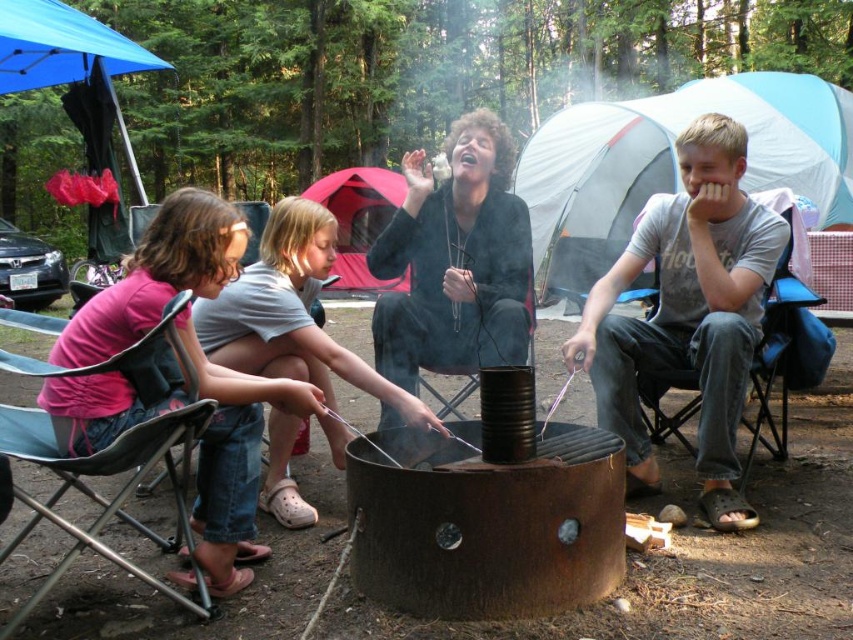
Is teal fabric chair at lower left wider than red fabric tent at center?

No.

This screenshot has width=853, height=640. What do you see at coordinates (103, 474) in the screenshot?
I see `teal fabric chair at lower left` at bounding box center [103, 474].

Which is behind, point (142, 456) or point (370, 291)?

Point (370, 291)

Where is `teal fabric chair at lower left`? teal fabric chair at lower left is located at coordinates (103, 474).

Measure the distance from gray cotton t-shirt at center to red fabric tent at center.

gray cotton t-shirt at center is 6.70 meters from red fabric tent at center.

Find the location of a particular element. This screenshot has width=853, height=640. gray cotton t-shirt at center is located at coordinates (688, 312).

Is denim shorts at center wider than teal fabric chair at lower left?

Yes.

Where is `denim shorts at center`? The height and width of the screenshot is (640, 853). denim shorts at center is located at coordinates (291, 314).

Find the location of a particular element. This screenshot has width=853, height=640. denim shorts at center is located at coordinates (291, 314).